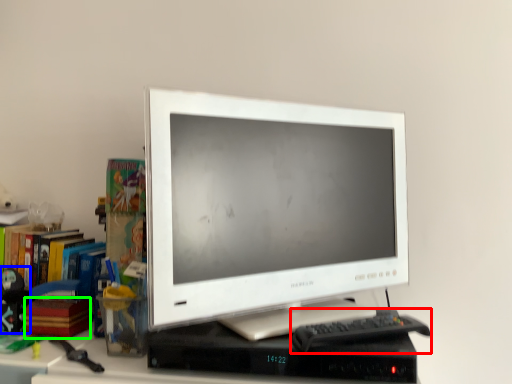
Question: Which object is the farthest from keyboard (highlighted by a red box)? Choose among these: toy (highlighted by a blue box) or paperback book (highlighted by a green box).

Choices:
 (A) toy
 (B) paperback book

Answer: (A)